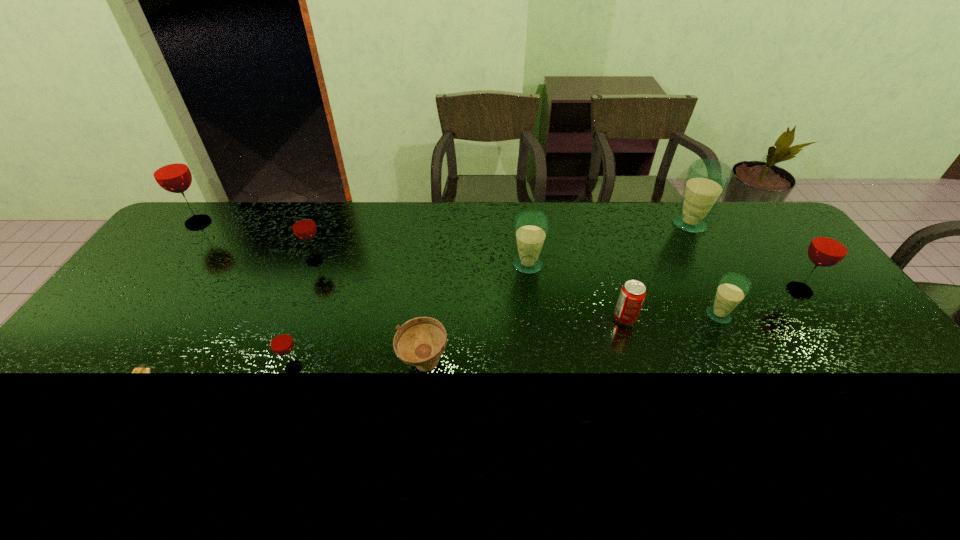
This screenshot has height=540, width=960. In order to click on free space at the near edge of the desktop in this screenshot , I will do `click(389, 458)`.

In the image, there is a desktop. Where is `vacant region at the left edge`? vacant region at the left edge is located at coordinates (132, 354).

The image size is (960, 540). Identify the location of free space at the right edge of the desktop. (782, 287).

Locate an element on the screen. The image size is (960, 540). vacant region at the near left corner of the desktop is located at coordinates (34, 467).

Find the location of a particular element. This screenshot has height=540, width=960. vacant area that lies between the farthest red glass and the second smallest red glass is located at coordinates (256, 241).

This screenshot has height=540, width=960. I want to click on free space between the third biggest red glass and the soup bowl, so click(x=370, y=312).

Image resolution: width=960 pixels, height=540 pixels. What are the coordinates of `vacant space that is in between the farthest blue glass and the second object from left to right` in the screenshot? It's located at [x=418, y=316].

Where is `unoccupied position between the nearest glass and the second smallest red glass`? unoccupied position between the nearest glass and the second smallest red glass is located at coordinates (304, 314).

Find the location of `free spot between the pistol and the soda`. free spot between the pistol and the soda is located at coordinates (385, 363).

Find the location of `empty space between the third smallest red glass and the smallest red glass`. empty space between the third smallest red glass and the smallest red glass is located at coordinates (546, 329).